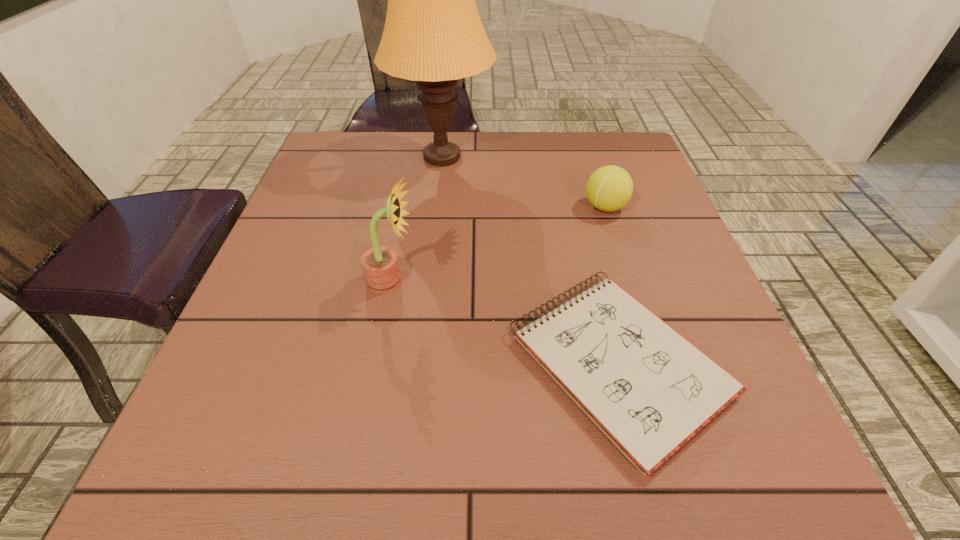
Find the location of a particular element. object at the far edge is located at coordinates (433, 34).

You are a GUI agent. You are given a task and a screenshot of the screen. Output one action in this format:
    pyautogui.click(x=<x>, y=<y>)
    Task: Click on the object that is at the near edge
    
    Given the screenshot: What is the action you would take?
    pyautogui.click(x=650, y=390)

What are the coordinates of `tennis ball positioned at the right edge` in the screenshot? It's located at (609, 188).

Where is `notepad present at the right edge`? This screenshot has height=540, width=960. notepad present at the right edge is located at coordinates (650, 390).

The width and height of the screenshot is (960, 540). Identify the location of object present at the near right corner. (650, 390).

Where is `free space at the far edge`? The image size is (960, 540). free space at the far edge is located at coordinates (543, 163).

Locate an element on the screen. The image size is (960, 540). free space at the near edge of the desktop is located at coordinates click(403, 437).

Identify the location of vacant space at the left edge of the desktop. This screenshot has height=540, width=960. (306, 219).

Where is `vacant space at the right edge of the desktop`? The height and width of the screenshot is (540, 960). vacant space at the right edge of the desktop is located at coordinates (727, 369).

At what (x,y) coordinates should I click in order to perform the action: click on vacant space at the far left corner of the desktop. Please return your answer as a coordinate pair (x, y). This screenshot has width=960, height=540. Looking at the image, I should click on (322, 148).